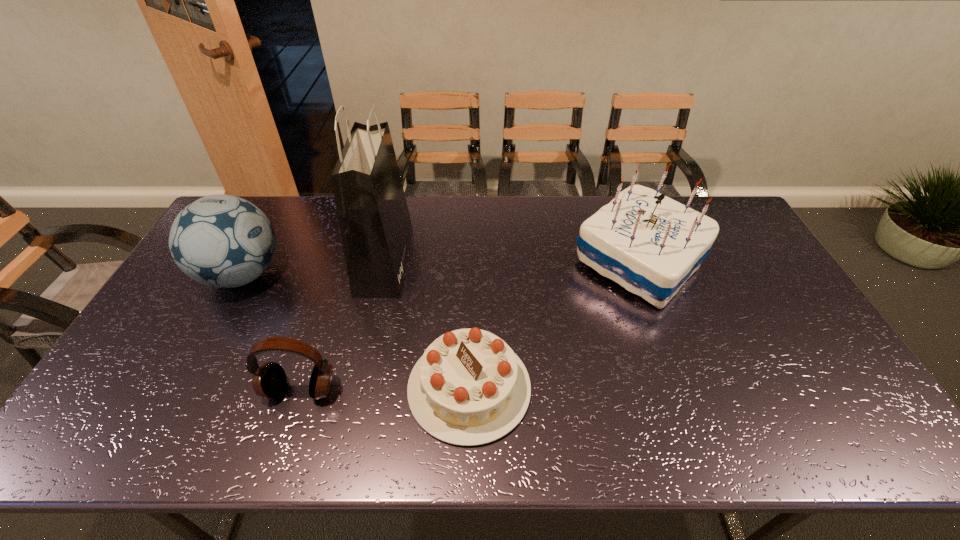
Identify the location of vacant space that satisfies the following two spatial constraints: 1. on the front with handles of the tallest object; 2. on the right side of the left birthday cake. Image resolution: width=960 pixels, height=540 pixels. (356, 388).

The image size is (960, 540). Identify the location of free space that satisfies the following two spatial constraints: 1. on the front with handles of the rightmost object; 2. on the right side of the tallest object. (385, 261).

This screenshot has height=540, width=960. What are the coordinates of `vacant region that satisfies the following two spatial constraints: 1. on the front with handles of the shopping bag; 2. on the left side of the shortest object` in the screenshot? It's located at (356, 388).